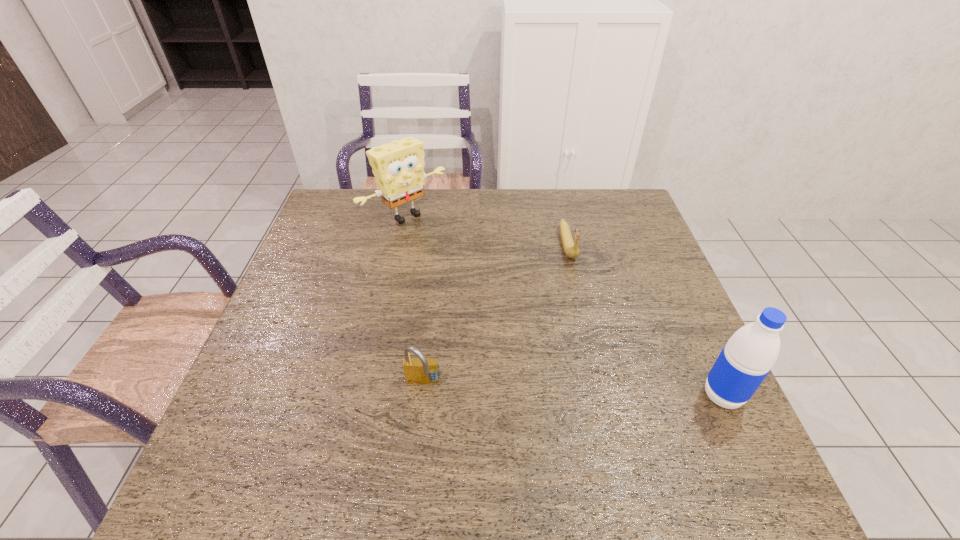
Locate an element on the screen. vacant area situated 0.310m on the face of the sponge is located at coordinates (492, 286).

This screenshot has width=960, height=540. Identify the location of vacant space located 0.140m on the face of the sponge. (455, 254).

Locate an element on the screen. This screenshot has height=540, width=960. banana that is at the far edge is located at coordinates (571, 249).

At what (x,y) coordinates should I click in order to perform the action: click on sponge at the far edge. Please return your answer as a coordinate pair (x, y). Looking at the image, I should click on (398, 167).

Locate an element on the screen. object positioned at the near edge is located at coordinates (749, 355).

Identify the location of object present at the left edge. (398, 167).

The height and width of the screenshot is (540, 960). I want to click on object that is at the right edge, so click(x=749, y=355).

What are the coordinates of `object located in the far left corner section of the desktop` in the screenshot? It's located at (398, 167).

Locate an element on the screen. This screenshot has height=540, width=960. object located at the near right corner is located at coordinates pos(749,355).

Identify the location of vacant space at the far edge. Image resolution: width=960 pixels, height=540 pixels. (467, 227).